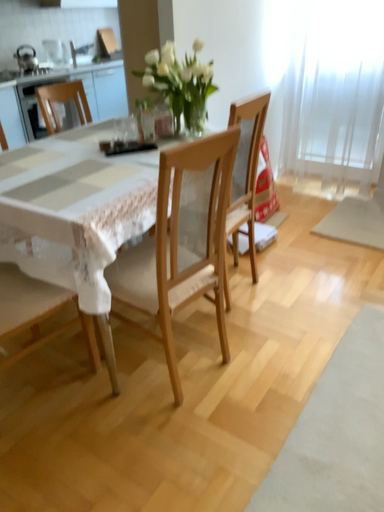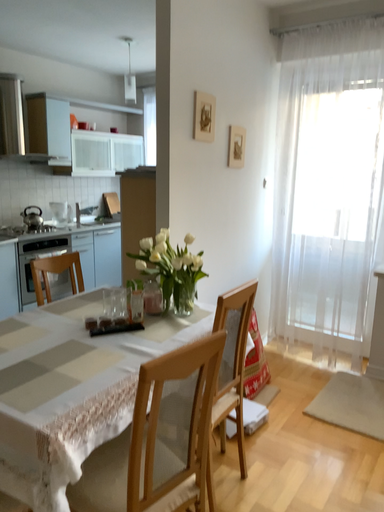
Question: How did the camera likely rotate when shooting the video?

Choices:
 (A) rotated downward
 (B) rotated upward

Answer: (B)